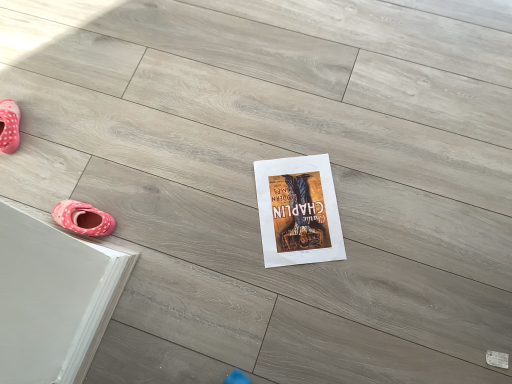
What do you see at coordinates (82, 218) in the screenshot?
I see `pink polka dot fabric shoe at lower left` at bounding box center [82, 218].

What is the approximate width of pink polka dot fabric shoe at lower left?

4.97 inches.

The width and height of the screenshot is (512, 384). Identify the location of pink polka dot fabric shoe at lower left. [82, 218].

Find the location of a particular element. The height and width of the screenshot is (384, 512). pink polka dot fabric shoe at lower left is located at coordinates (82, 218).